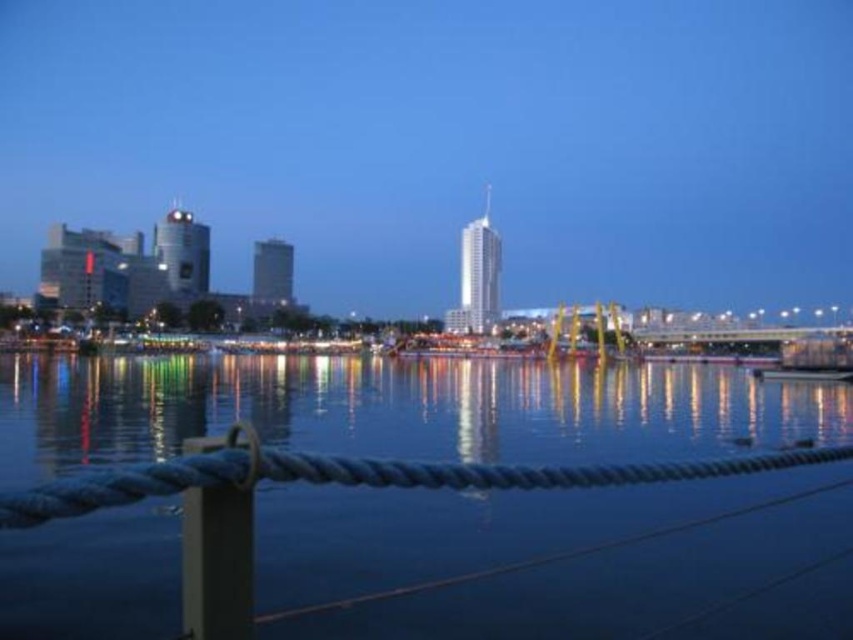
Question: Which point is farther from the camera taking this photo?

Choices:
 (A) (184, 499)
 (B) (10, 388)

Answer: (B)

Question: Can you confirm if dark blue water at center is positioned below metallic gray pole at lower left?

Choices:
 (A) yes
 (B) no

Answer: (A)

Question: Among these objects, which one is nearest to the camera?

Choices:
 (A) dark blue water at center
 (B) metallic gray pole at lower left

Answer: (B)

Question: Which point appears closest to the camera in this image?

Choices:
 (A) (47, 449)
 (B) (212, 577)

Answer: (B)

Question: Can you confirm if dark blue water at center is bigger than metallic gray pole at lower left?

Choices:
 (A) yes
 (B) no

Answer: (A)

Question: Can you confirm if dark blue water at center is wider than metallic gray pole at lower left?

Choices:
 (A) yes
 (B) no

Answer: (A)